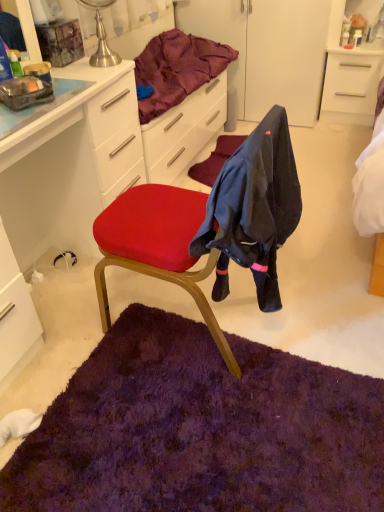
Question: Based on their positions, is purple shaggy mat at lower center located to the left or right of dark blue fabric at center?

Choices:
 (A) left
 (B) right

Answer: (A)

Question: Is purple shaggy mat at lower center taller or shorter than dark blue fabric at center?

Choices:
 (A) short
 (B) tall

Answer: (A)

Question: Which object is positioned farthest from the velvet red chair at center?

Choices:
 (A) purple shaggy mat at lower center
 (B) white glossy cabinet at upper right, acting as the 1th cabinetry starting from the back
 (C) velvet purple blanket at upper center
 (D) dark blue fabric at center
 (E) white glossy cabinet at left, the 2th cabinetry viewed from the right

Answer: (B)

Question: Estimate the real-world distances between objects in this image. Which object is farther from the purple shaggy mat at lower center?

Choices:
 (A) white glossy cabinet at left, which is the first cabinetry from bottom to top
 (B) dark blue fabric at center
 (C) velvet purple blanket at upper center
 (D) velvet red chair at center
 (E) white glossy cabinet at upper right, arranged as the first cabinetry when viewed from the top

Answer: (E)